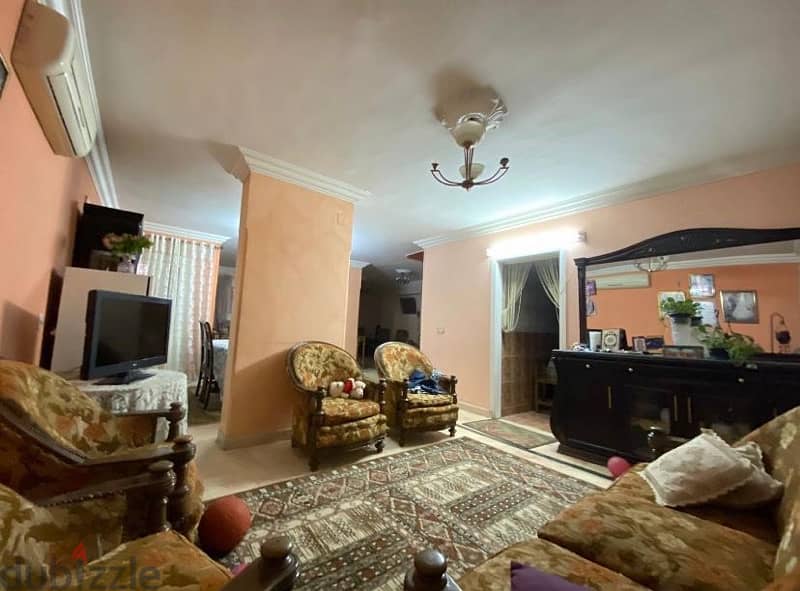
The height and width of the screenshot is (591, 800). I want to click on white tablecloth, so click(141, 392).